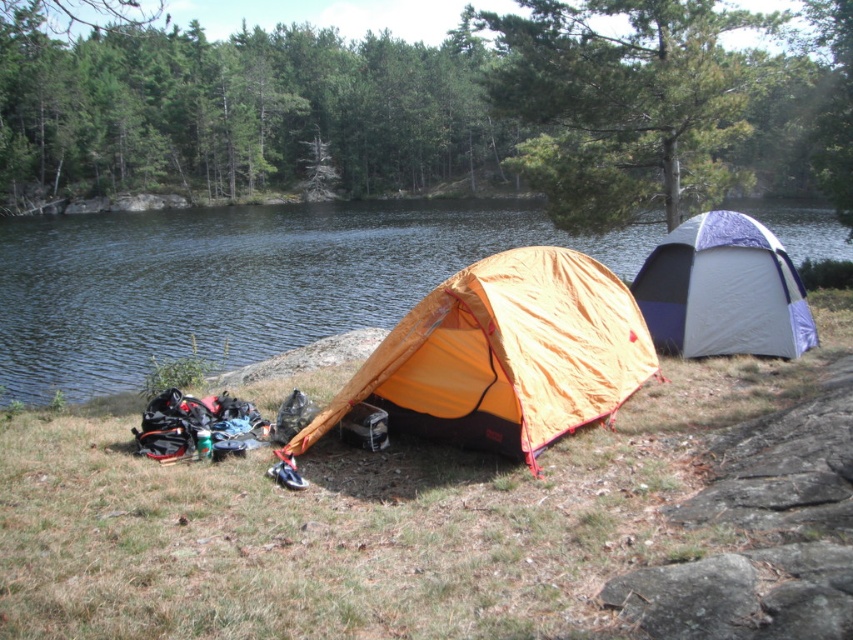
Based on the photo, who is higher up, transparent blue water at center or white and purple fabric tent at right?

transparent blue water at center

Can you confirm if transparent blue water at center is shorter than white and purple fabric tent at right?

No.

Between point (564, 241) and point (663, 316), which one is positioned in front?

Positioned in front is point (663, 316).

This screenshot has width=853, height=640. Identify the location of transparent blue water at center. (238, 280).

Is point (125, 296) positioned in front of point (498, 257)?

No, it is not.

From the picture: Which of these two, transparent blue water at center or orange nylon tent at center, stands taller?

Standing taller between the two is transparent blue water at center.

Which is in front, point (833, 230) or point (581, 413)?

Point (581, 413) is in front.

Locate an element on the screen. This screenshot has height=640, width=853. transparent blue water at center is located at coordinates (238, 280).

Describe the element at coordinates (505, 355) in the screenshot. I see `orange nylon tent at center` at that location.

Measure the distance between point (576, 380) and camera.

Point (576, 380) is 6.88 meters from camera.

Image resolution: width=853 pixels, height=640 pixels. Identify the location of orange nylon tent at center. (505, 355).

This screenshot has width=853, height=640. I want to click on orange nylon tent at center, so click(505, 355).